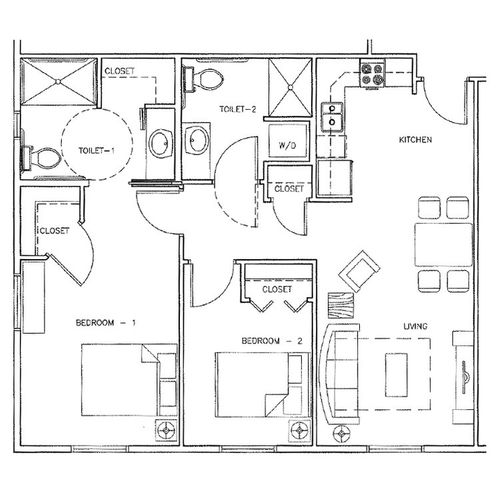
At what (x,y) coordinates should I click in order to perform the action: click on second bedroom area. Please return your answer as a coordinate pair (x, y). This screenshot has width=500, height=500. Looking at the image, I should click on (223, 326), (286, 333), (206, 391), (249, 429).